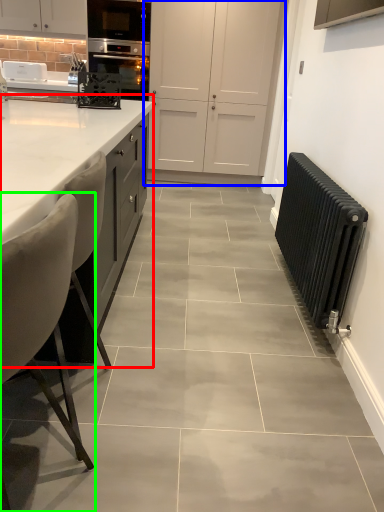
Question: Considering the real-world distances, which object is closest to countertop (highlighted by a red box)? cabinetry (highlighted by a blue box) or chair (highlighted by a green box).

Choices:
 (A) cabinetry
 (B) chair

Answer: (B)